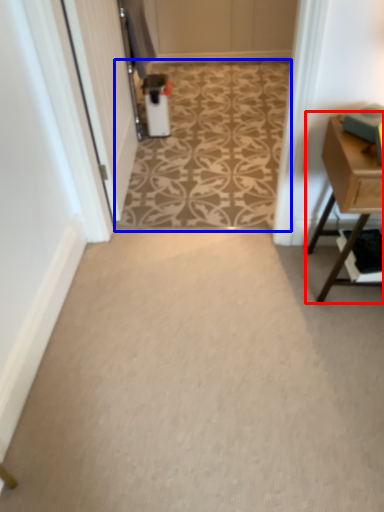
Question: Which object is further to the camera taking this photo, table (highlighted by a red box) or pattern (highlighted by a blue box)?

Choices:
 (A) table
 (B) pattern

Answer: (B)